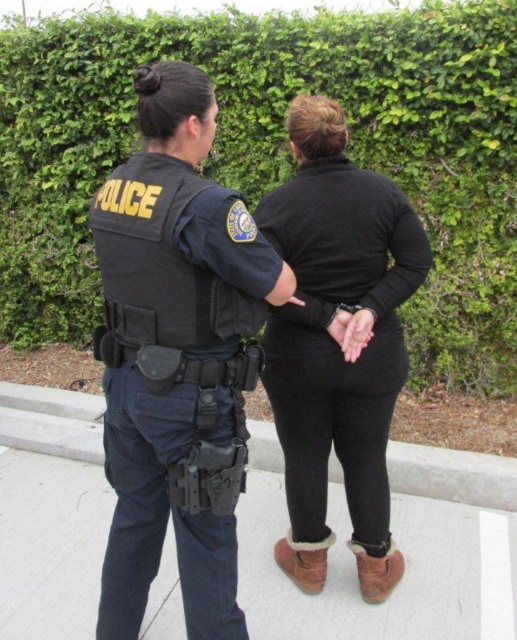
You are a security guard tasked with identifying the location of the black tactical vest at center in the scene. Based on the coordinates provided, can you determine if it is positioned closer to the police officer or the individual in black clothing?

The black tactical vest at center is located at point 0.602 on the x and 0.340 on the y axis. Since the coordinates are between the two individuals, it is positioned closer to the police officer on the left.

You are a pedestrian on the sidewalk and want to walk between the green leafy hedge at upper center and the black matte sweater at center. Can you pass through the space between them?

The green leafy hedge at upper center is wider than the black matte sweater at center, so there is enough space to walk between them. Yes, you can pass through the space between them.

You are a pedestrian standing on the sidewalk and want to cross the street. There is a green leafy hedge at upper center in your view. Can you see the police officer and the person in black clothing behind the hedge?

The green leafy hedge at upper center is located at point (277, 150), which is above and to the left of the two individuals. Since the hedge is at a higher position, it might block your view of the people standing behind it on the sidewalk.